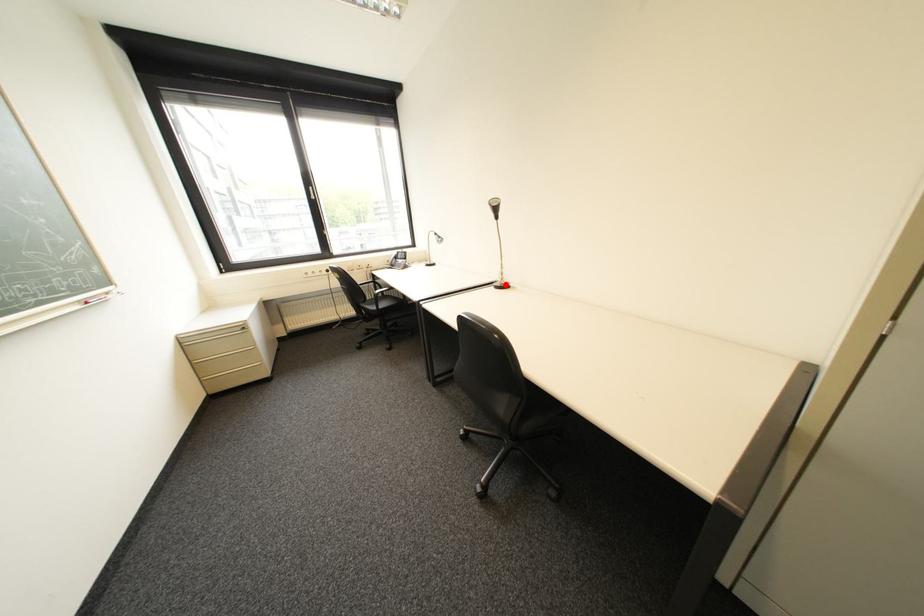
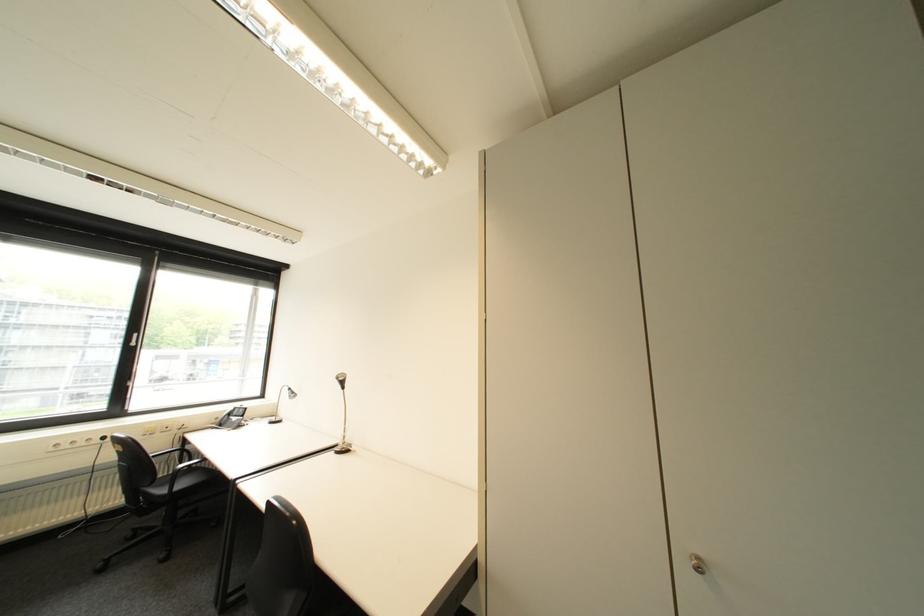
Question: I am providing you with two images of the same scene from different viewpoints. A red point is shown in image1. For the corresponding object point in image2, is it positioned nearer or farther from the camera?

Choices:
 (A) Nearer
 (B) Farther

Answer: (B)